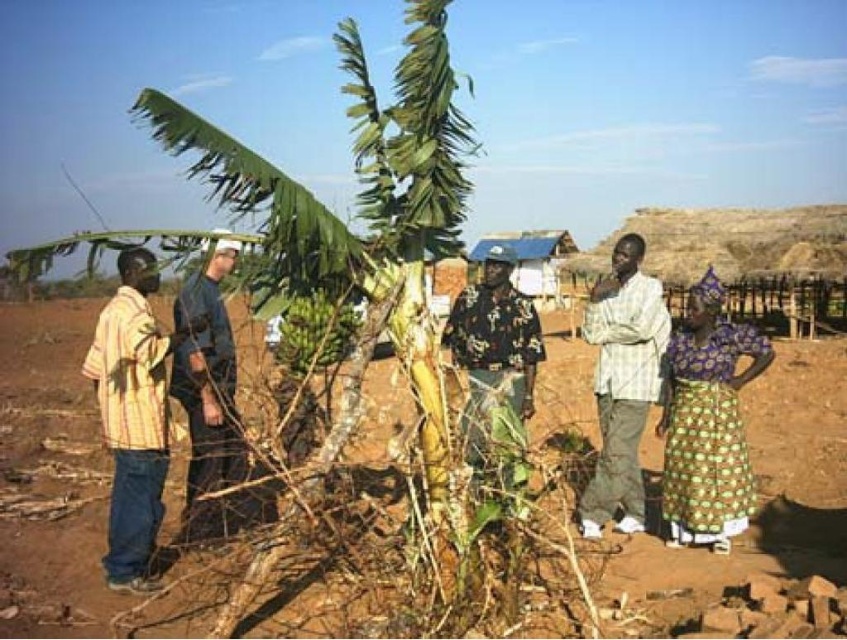
Question: Among these points, which one is farthest from the camera?

Choices:
 (A) (231, 268)
 (B) (253, 358)
 (C) (731, 330)

Answer: (B)

Question: Can you confirm if brown soil at center is positioned to the left of yellow striped shirt at left?

Choices:
 (A) yes
 (B) no

Answer: (B)

Question: Is printed fabric dress at right in front of white checkered shirt at center?

Choices:
 (A) no
 (B) yes

Answer: (B)

Question: Which point is closer to the camera?

Choices:
 (A) green matte bananas at center
 (B) dark blue uniform at center
 (C) printed fabric dress at right

Answer: (A)

Question: Which of the following is the closest to the observer?

Choices:
 (A) white checkered shirt at center
 (B) green matte bananas at center
 (C) camouflage fabric shirt at center

Answer: (B)

Question: Is dark blue uniform at center positioned before camouflage fabric shirt at center?

Choices:
 (A) yes
 (B) no

Answer: (A)